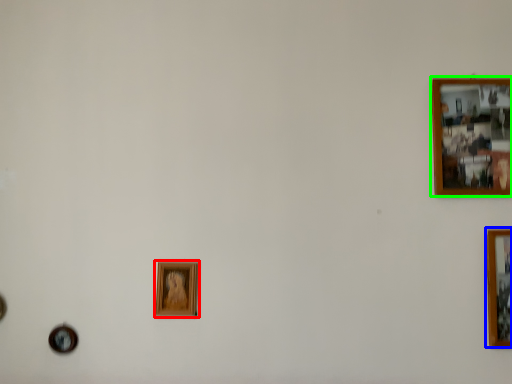
Question: Based on their relative distances, which object is farther from picture frame (highlighted by a red box)? Choose from picture frame (highlighted by a blue box) and picture frame (highlighted by a green box).

Choices:
 (A) picture frame
 (B) picture frame

Answer: (A)